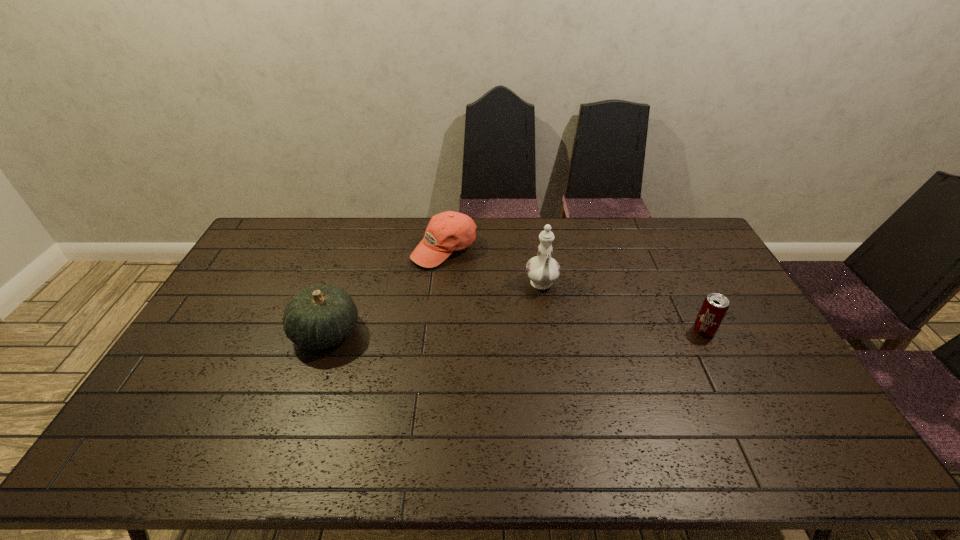
Where is `the second tallest object`? the second tallest object is located at coordinates (319, 316).

Find the location of a particular element. Image resolution: width=960 pixels, height=540 pixels. the leftmost object is located at coordinates (319, 316).

What are the coordinates of `the rightmost object` in the screenshot? It's located at (715, 306).

Identify the location of the third object from left to right. (542, 270).

Where is `chinaware`? This screenshot has width=960, height=540. chinaware is located at coordinates (542, 270).

At what (x,y) coordinates should I click in order to perform the action: click on the third object from right to left. Please return your answer as a coordinate pair (x, y). The width and height of the screenshot is (960, 540). Looking at the image, I should click on (449, 231).

Locate an element on the screen. The height and width of the screenshot is (540, 960). the farthest object is located at coordinates (449, 231).

What are the coordinates of `vacant space situated on the back of the gourd` in the screenshot? It's located at (350, 262).

Image resolution: width=960 pixels, height=540 pixels. What are the coordinates of `vacant space situated on the left of the beer can` in the screenshot? It's located at (577, 331).

Locate an element on the screen. vacant space located at the spout of the tallest object is located at coordinates (549, 333).